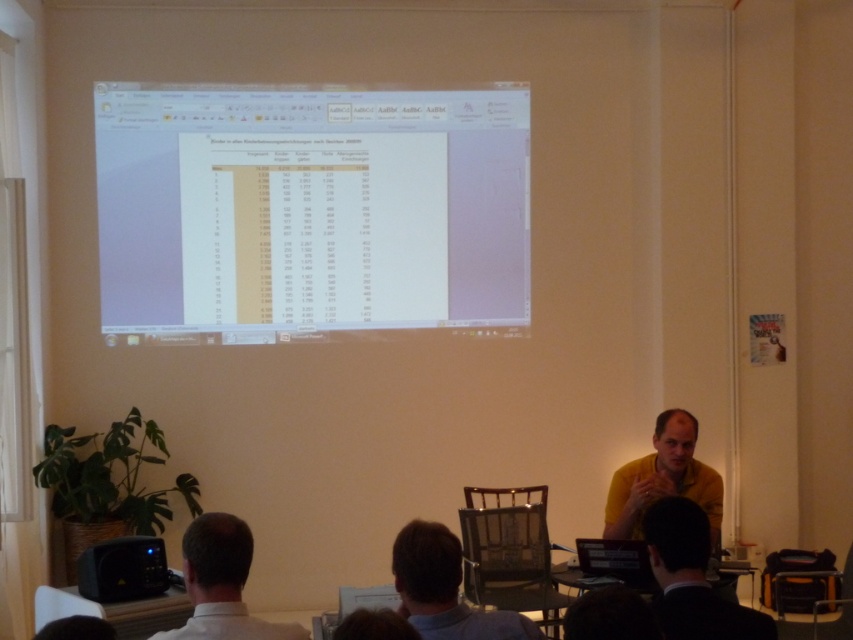
You are standing in front of the presentation screen and notice two points marked on the screen. The first point is at coordinates point (436, 90) and the second is at point (498, 621). Which point is closer to you?

The point at coordinates point (436, 90) is closer to you because it is further to the viewer than point (498, 621).

You are an attendee at the presentation and need to hand a document to the presenter. The presenter is wearing a dark suit at lower right. Where should you place the white paper at center so that it is visible to the presenter?

The white paper at center should be placed above the dark suit at lower right to ensure visibility to the presenter.

You are an attendee in the presentation and you see the point at coordinates (310, 211) on the projection screen. What object is located at that point?

The point at coordinates (310, 211) corresponds to the white paper at center.